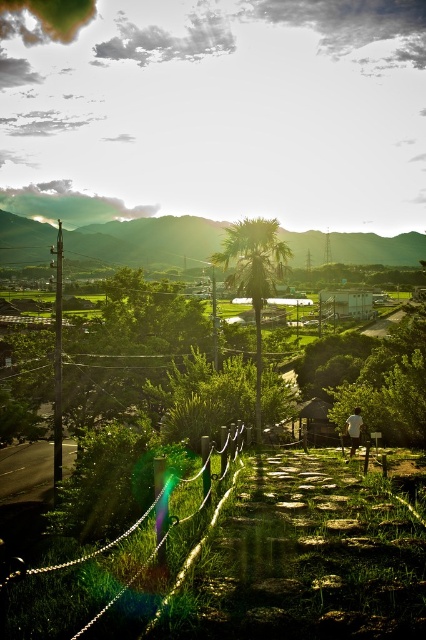
Question: Which of the following is the farthest from the observer?

Choices:
 (A) (354, 410)
 (B) (219, 241)
 (C) (172, 545)
 (D) (227, 253)

Answer: (B)

Question: Does green grassy hillside at center have a greater width compared to white cotton shirt at lower right?

Choices:
 (A) yes
 (B) no

Answer: (A)

Question: Can you confirm if green chain-link fence at lower left is wider than white cotton shirt at lower right?

Choices:
 (A) no
 (B) yes

Answer: (A)

Question: Which point is farther from the camera taking this photo?

Choices:
 (A) (256, 321)
 (B) (57, 628)
 (C) (144, 224)

Answer: (C)

Question: Can you confirm if green leafy palm tree at center is positioned to the right of white cotton shirt at lower right?

Choices:
 (A) no
 (B) yes

Answer: (A)

Question: Which object appears farthest from the camera in this image?

Choices:
 (A) green chain-link fence at lower left
 (B) green leafy palm tree at center
 (C) green grassy hillside at center
 (D) white cotton shirt at lower right

Answer: (C)